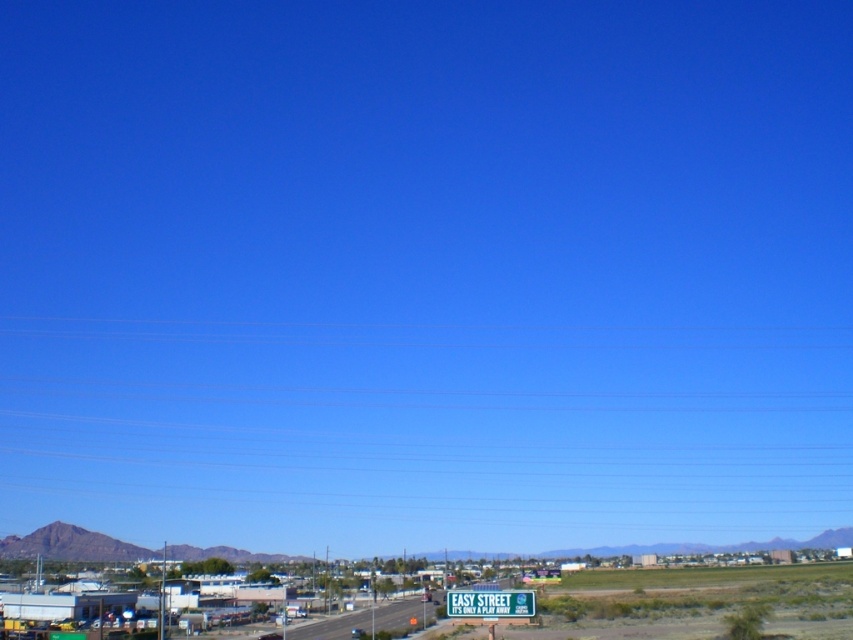
You are driving a truck that is 2.5 meters wide. You see the smooth asphalt highway at center and the green plastic sign at lower center. Which one is wider?

The smooth asphalt highway at center is wider than the green plastic sign at lower center according to the description.